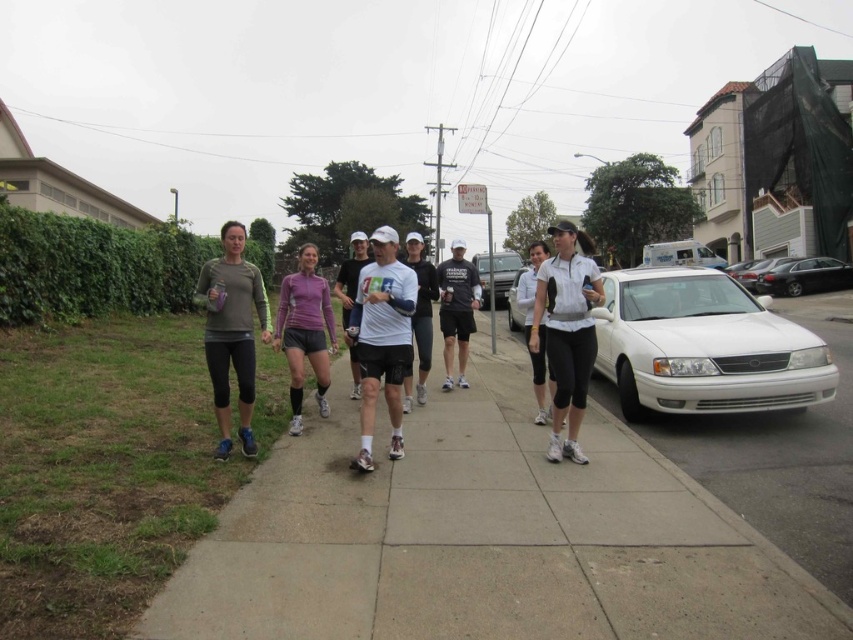
Question: Which point is closer to the camera?

Choices:
 (A) (796, 259)
 (B) (425, 301)
 (C) (263, 292)
 (D) (517, 269)

Answer: (C)

Question: Which of the following is the closest to the observer?

Choices:
 (A) black cotton t-shirt at center
 (B) metallic silver suv at center
 (C) white glossy sedan at right
 (D) white matte cap at center

Answer: (D)

Question: Among these points, which one is farthest from the camera?

Choices:
 (A) (517, 321)
 (B) (497, 276)
 (C) (415, 330)
 (D) (570, 232)

Answer: (B)

Question: Does white matte athletic top at center have a lesser width compared to black cotton t-shirt at center?

Choices:
 (A) yes
 (B) no

Answer: (B)

Question: Is gray concrete sidewalk at center smaller than purple matte shorts at center?

Choices:
 (A) no
 (B) yes

Answer: (B)

Question: Does white glossy sedan at right appear over white matte t-shirt at center?

Choices:
 (A) no
 (B) yes

Answer: (A)